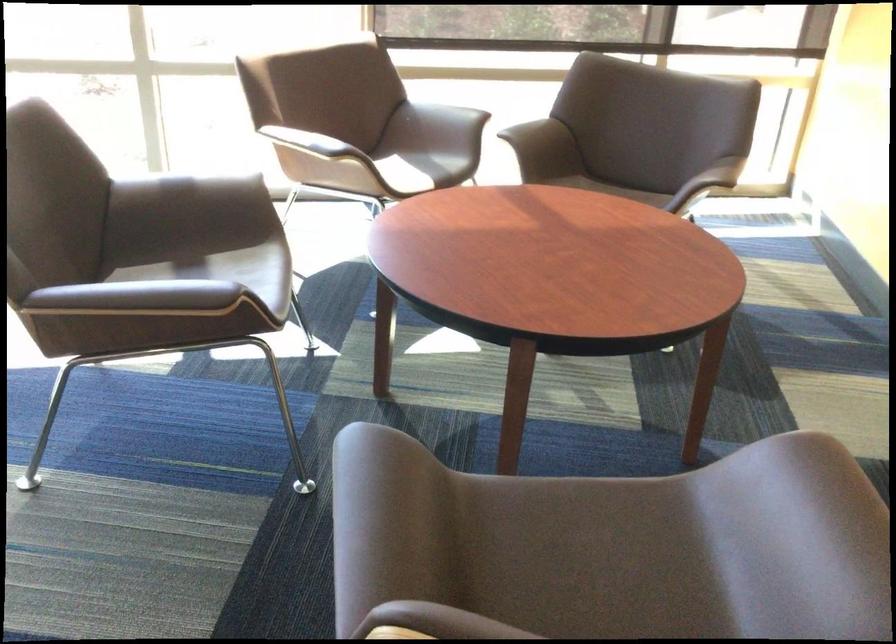
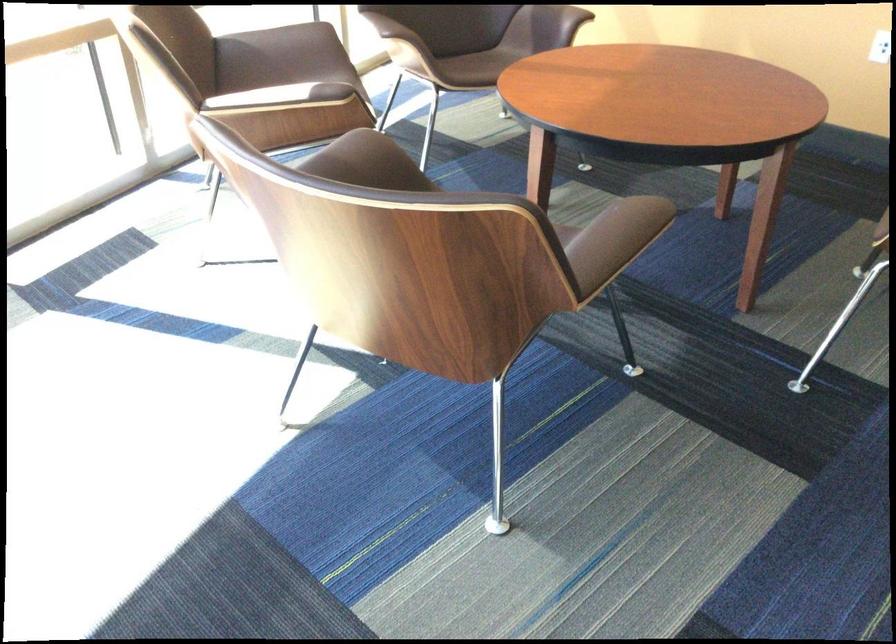
Find the pixel in the second image that matches point (436, 122) in the first image.

(281, 55)